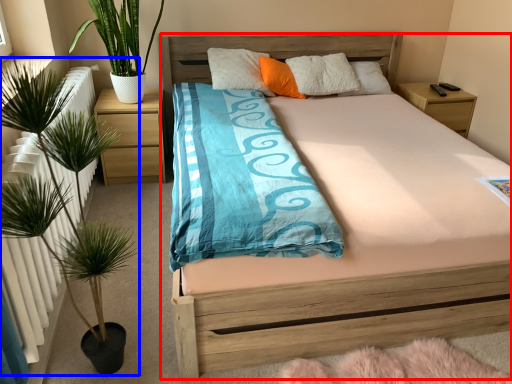
Question: Which object appears closest to the camera in this image, bed (highlighted by a red box) or houseplant (highlighted by a blue box)?

Choices:
 (A) bed
 (B) houseplant

Answer: (B)